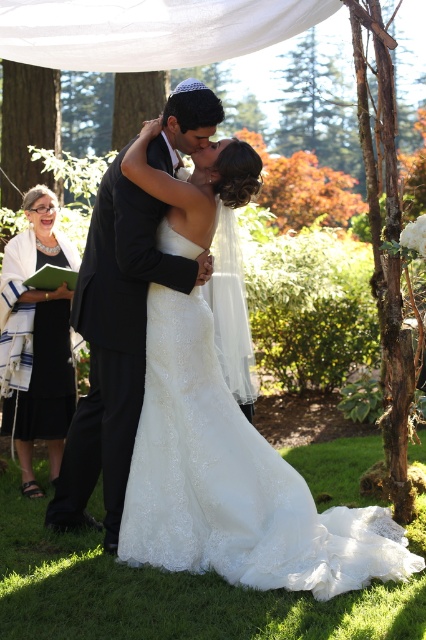
Question: Is white lace dress at center above black satin suit at center?

Choices:
 (A) yes
 (B) no

Answer: (B)

Question: Considering the real-world distances, which object is closest to the black satin suit at center?

Choices:
 (A) black dress at left
 (B) white lace dress at center

Answer: (B)

Question: Which point is closer to the camera taking this photo?

Choices:
 (A) (181, 356)
 (B) (39, 193)
 (C) (86, 321)

Answer: (A)

Question: Does black satin suit at center appear on the right side of black dress at left?

Choices:
 (A) yes
 (B) no

Answer: (A)

Question: Among these objects, which one is nearest to the camera?

Choices:
 (A) black dress at left
 (B) black satin suit at center

Answer: (B)

Question: Considering the relative positions of white lace dress at center and black satin suit at center in the image provided, where is white lace dress at center located with respect to black satin suit at center?

Choices:
 (A) left
 (B) right

Answer: (B)